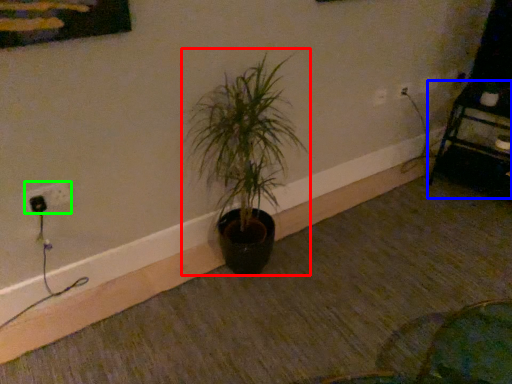
Question: Which object is the closest to the houseplant (highlighted by a red box)? Choose among these: furniture (highlighted by a blue box) or electric outlet (highlighted by a green box).

Choices:
 (A) furniture
 (B) electric outlet

Answer: (B)